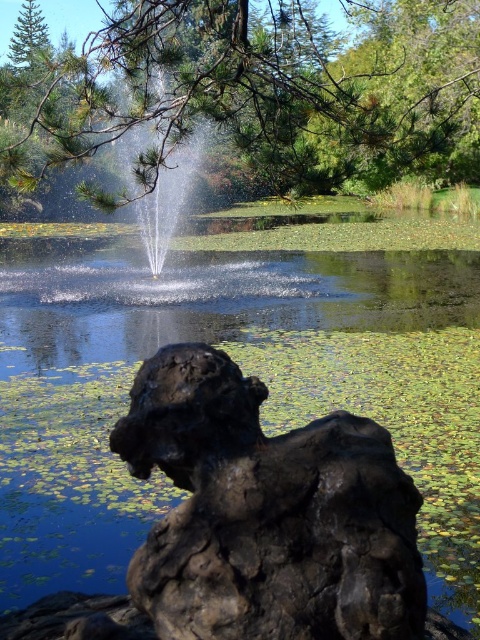
You are standing on the weathered dark brown tree stump in the foreground and want to see the rustic stone statue at center. Are the green lily pads at center blocking your view of the statue?

The rustic stone statue at center is behind the green lily pads at center, so yes, the green lily pads at center are blocking your view of the statue.

You are standing at the edge of the pond and want to place a small decorative statue exactly at the point marked as point (243,371). What object is located at that point?

The green lily pads at center are located at point (243,371).